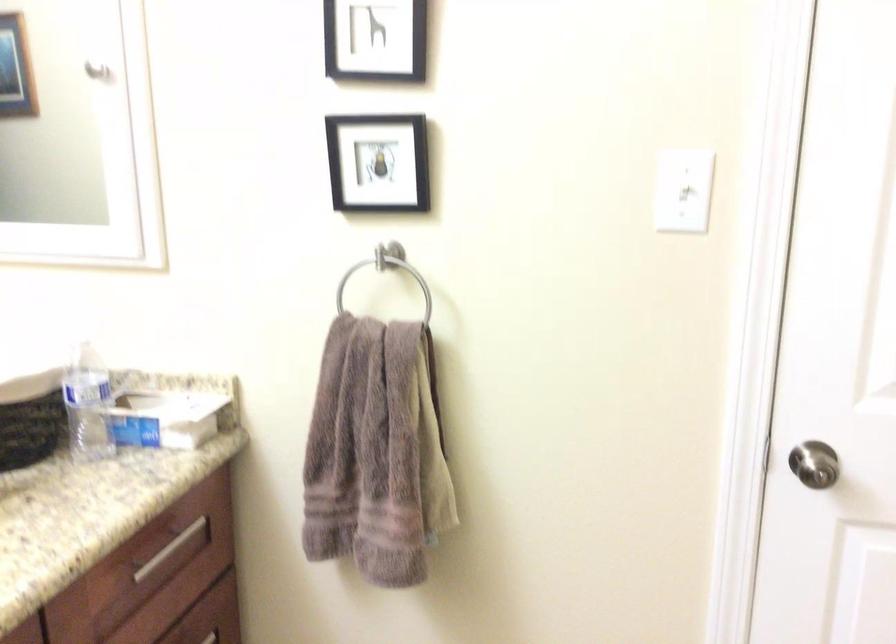
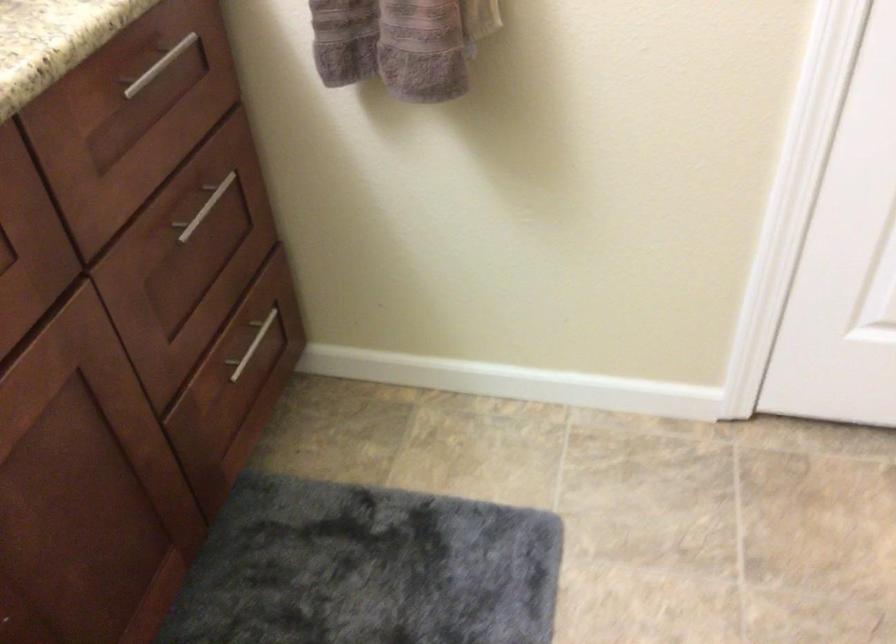
Find the pixel in the second image that matches pixel 168 542 in the first image.

(159, 66)